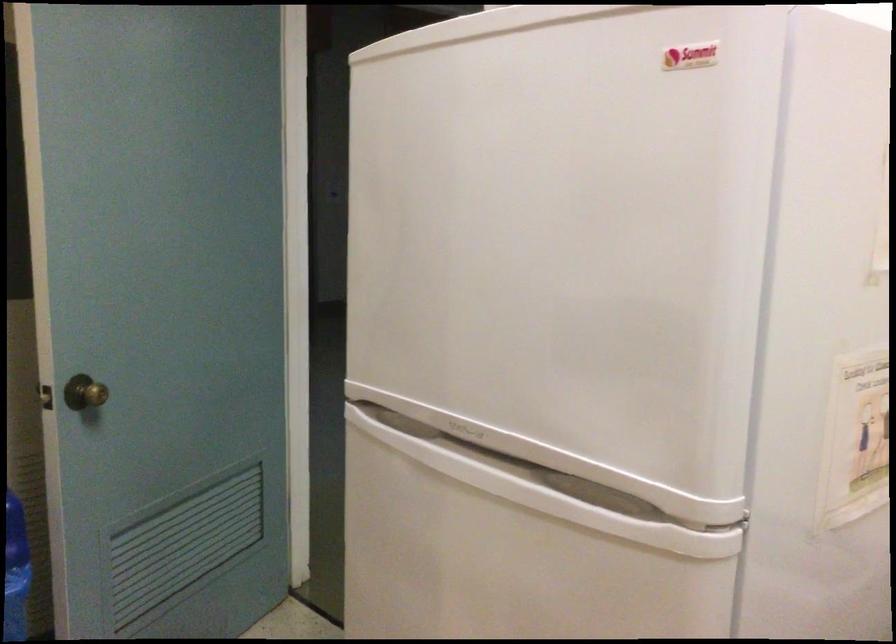
Identify the location of refrigerator door handle. This screenshot has width=896, height=644. (527, 451).